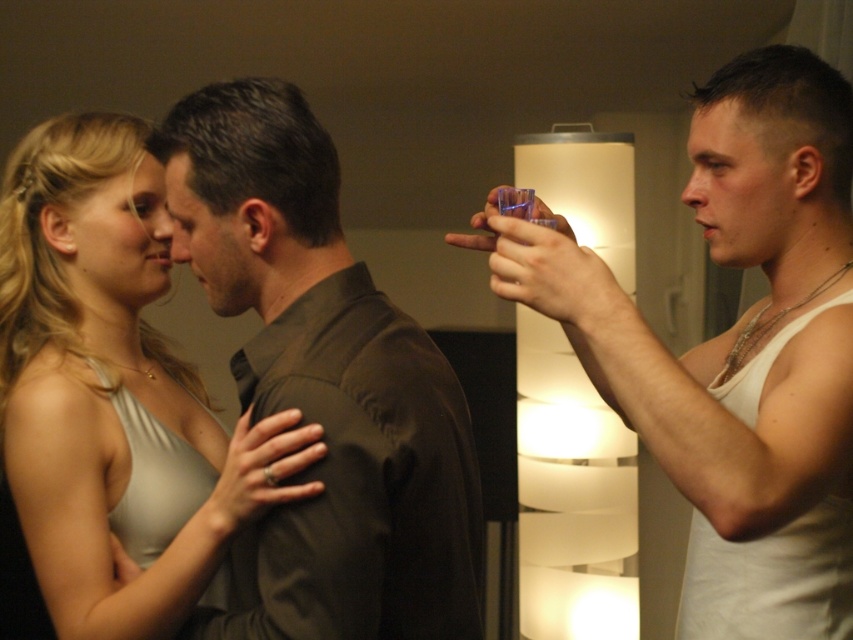
You are a bartender who needs to place a new drink on the table without blocking the view of the matte brown shirt at center. The translucent plastic cup at right is currently in the way. Can you move the cup to another location?

The translucent plastic cup at right is in front of the matte brown shirt at center, so moving it would allow the view of the matte brown shirt at center to remain unobstructed.

You are a photographer trying to capture a closeup shot of both the matte brown shirt at center and the matte silver dress at center. Since your camera can only focus on one subject at a time, which one should you choose to ensure the entire garment fits within the frame?

The matte brown shirt at center is narrower than the matte silver dress at center, so you should focus on the matte silver dress at center to ensure the entire garment fits within the frame.

You are standing in the room and want to move from point A to point B. Point A is at coordinates point (811, 131) and point B is at coordinates point (83, 465). Which point is closer to you?

Point point (811, 131) is closer to the viewer than point point (83, 465).